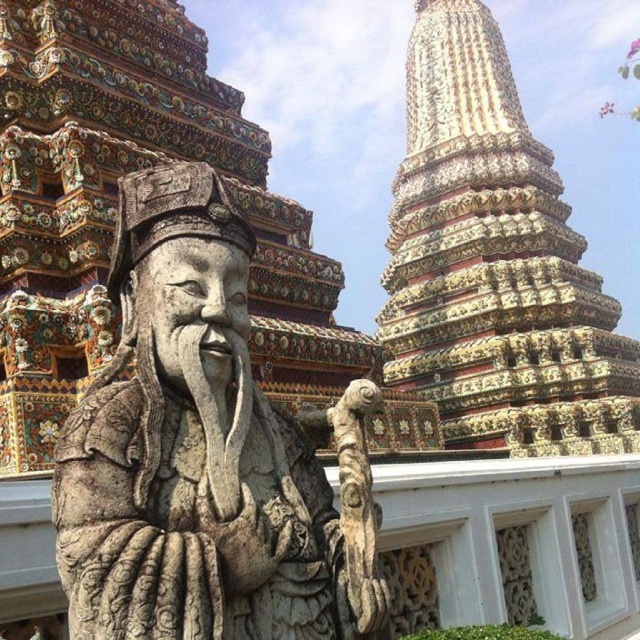
You are standing in front of the statue and want to know how far the point at coordinates (248, 467) is from you. Can you determine the distance?

The point at coordinates (248, 467) is 15.09 meters away from the camera, so the distance is 15.09 meters.

You are a visitor standing in front of the stone statue at center and the carved stone tower at upper right. Which object is located higher in the image?

The carved stone tower at upper right is positioned higher than the stone statue at center, as it is located above it in the image.